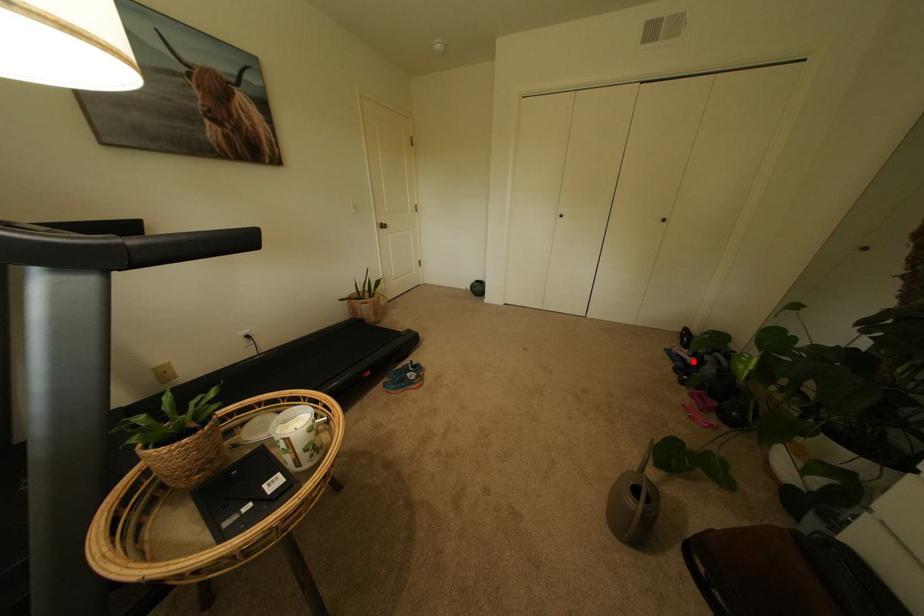
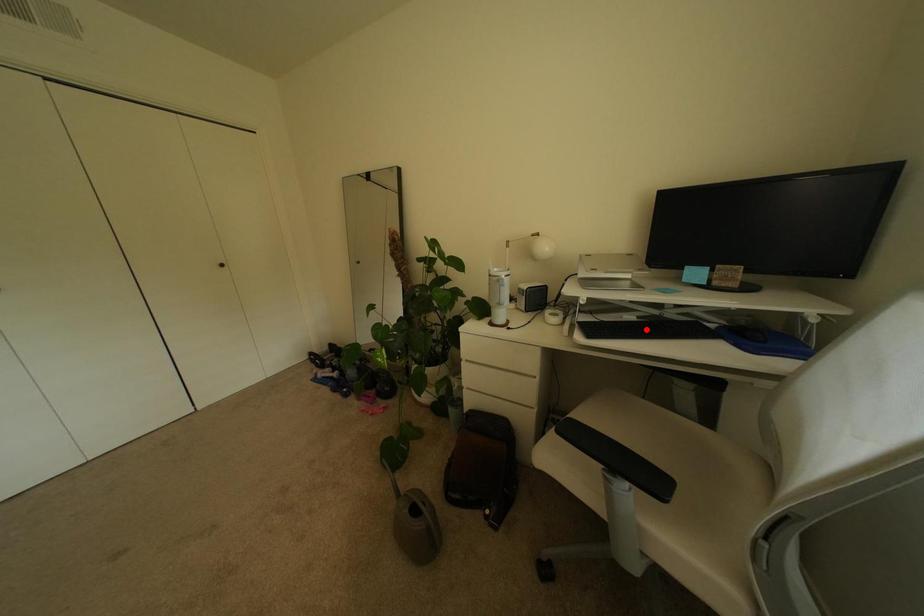
I am providing you with two images of the same scene from different viewpoints. A red point is marked on the first image and another point is marked on the second image. Is the red point in image1 aligned with the point shown in image2?

No